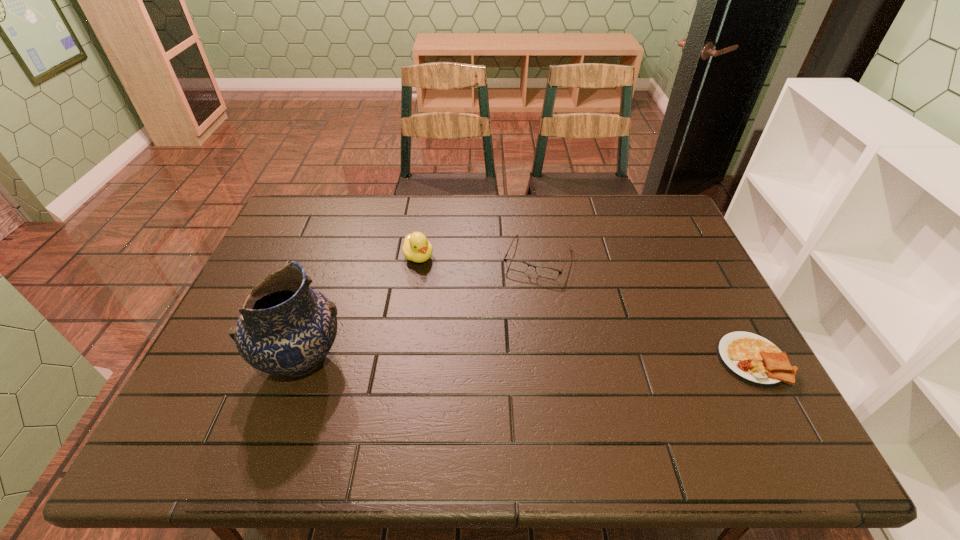
What are the coordinates of `vacant space on the desktop that is between the tallest object and the omelet and is positioned on the beak of the duckling` in the screenshot? It's located at (493, 360).

Identify the location of vacant spot on the desktop that is between the leftmost object and the omelet and is positioned on the front-facing side of the spectacles. The width and height of the screenshot is (960, 540). (497, 360).